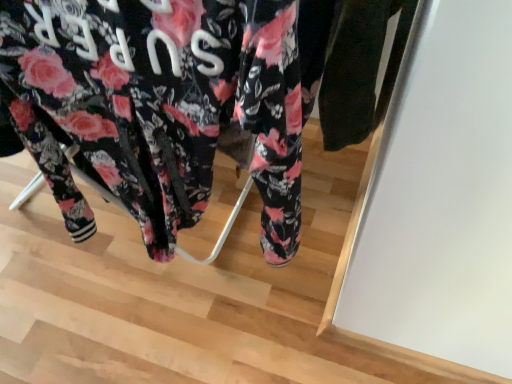
The image size is (512, 384). Describe the element at coordinates (182, 101) in the screenshot. I see `floral fabric pants at center` at that location.

I want to click on floral fabric pants at center, so click(x=182, y=101).

Measure the distance between floral fabric pants at center and camera.

floral fabric pants at center is 16.40 inches away from camera.

What is the approximate width of floral fabric pants at center?

7.37 inches.

Locate an element on the screen. Image resolution: width=512 pixels, height=384 pixels. floral fabric pants at center is located at coordinates (182, 101).